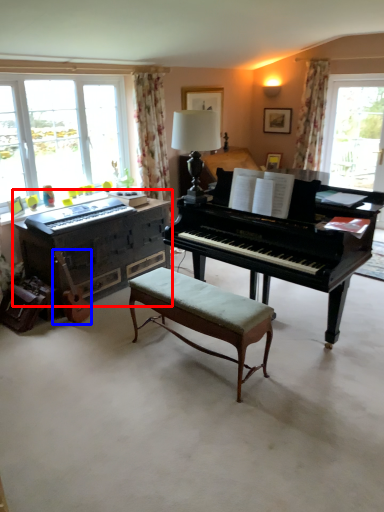
Question: Which point is closer to the camera, piano (highlighted by a red box) or instrument (highlighted by a blue box)?

Choices:
 (A) piano
 (B) instrument

Answer: (B)